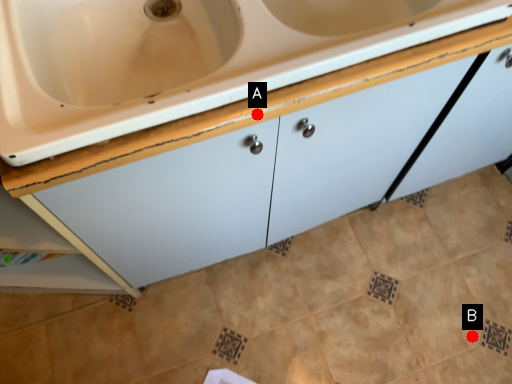
Question: Two points are circled on the image, labeled by A and B beside each circle. Which point is farther from the camera taking this photo?

Choices:
 (A) A is further
 (B) B is further

Answer: (B)